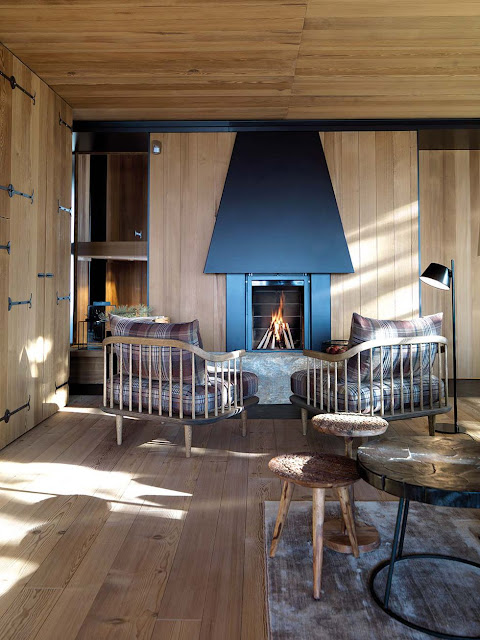
Where is `ceiling`? ceiling is located at coordinates (252, 57).